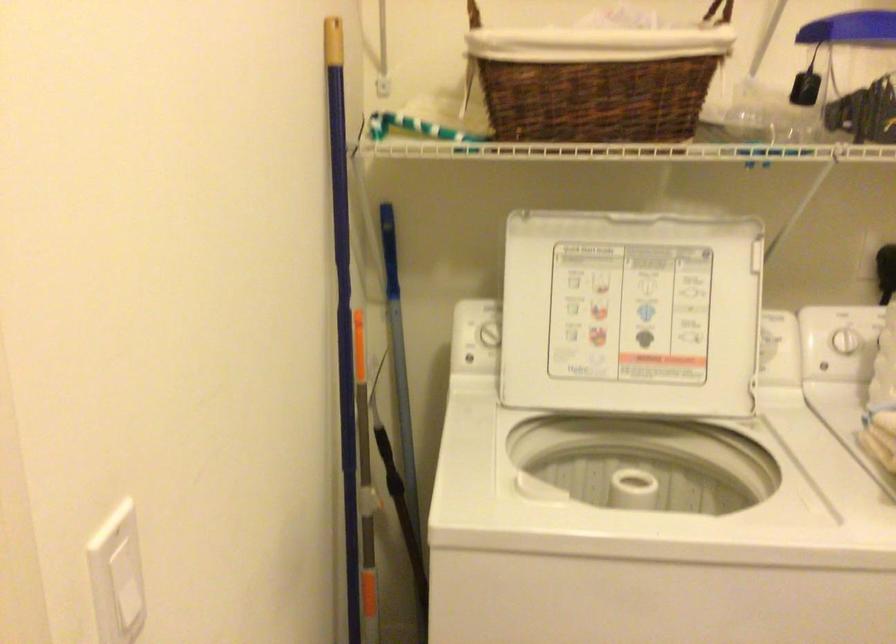
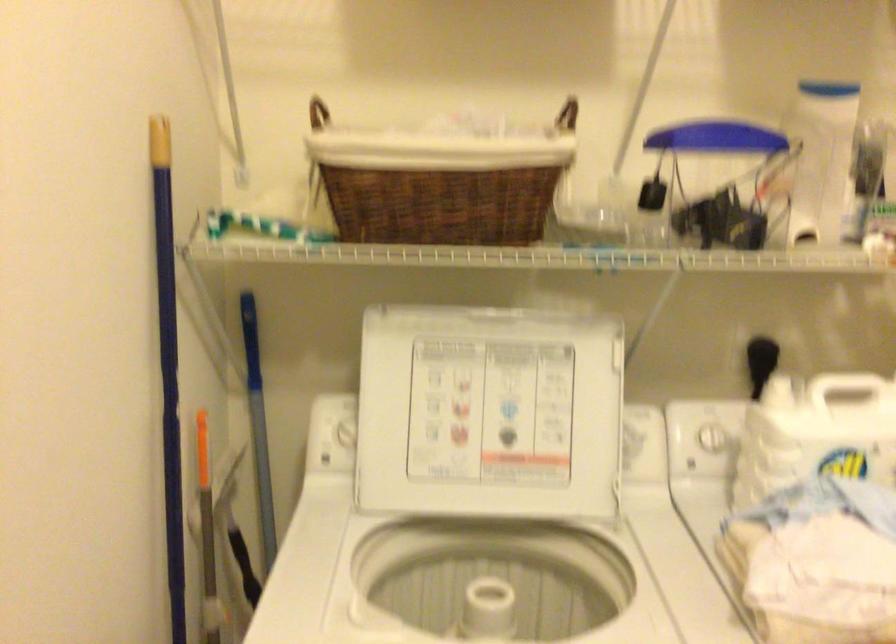
The point at (341, 263) is marked in the first image. Where is the corresponding point in the second image?

(168, 366)